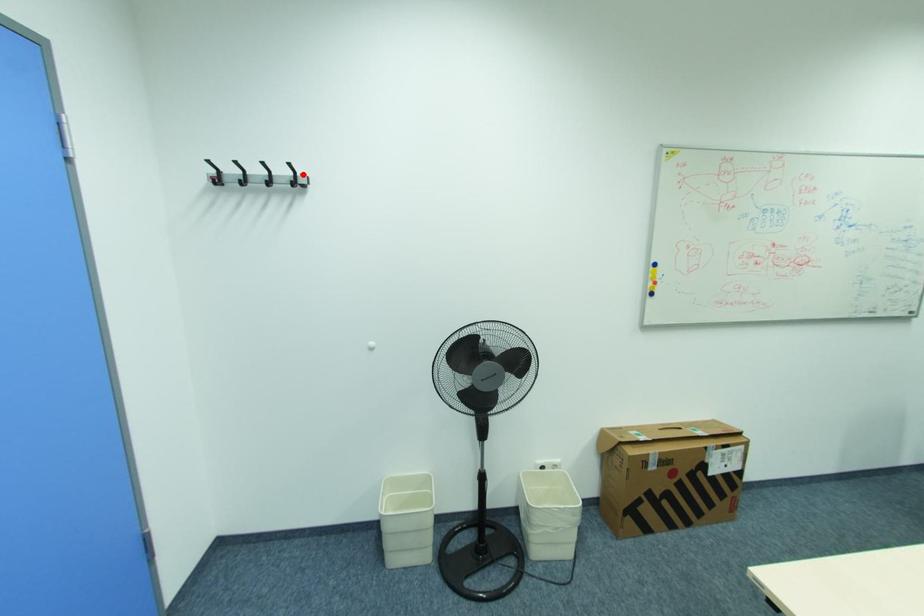
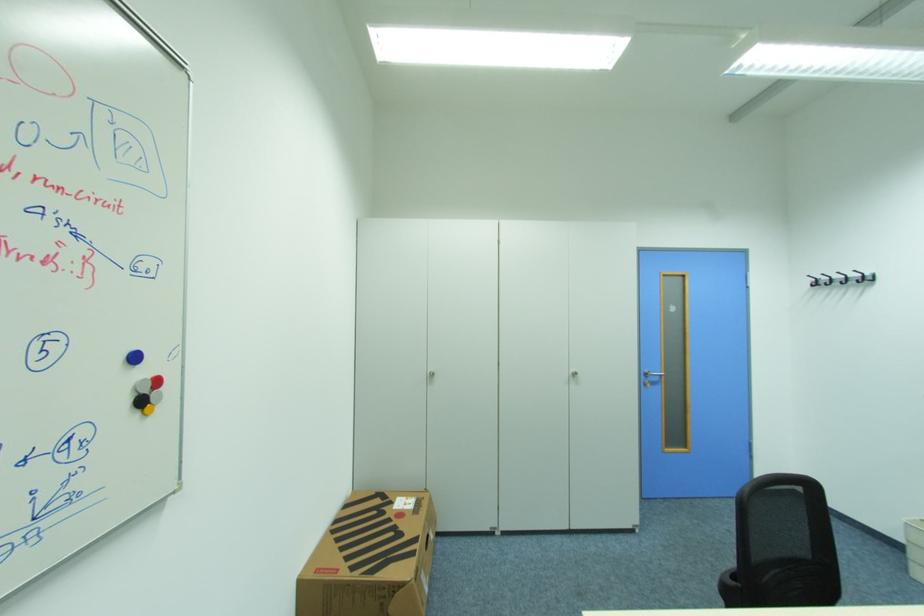
Find the pixel in the second image that matches the highlighted location in the first image.

(872, 275)